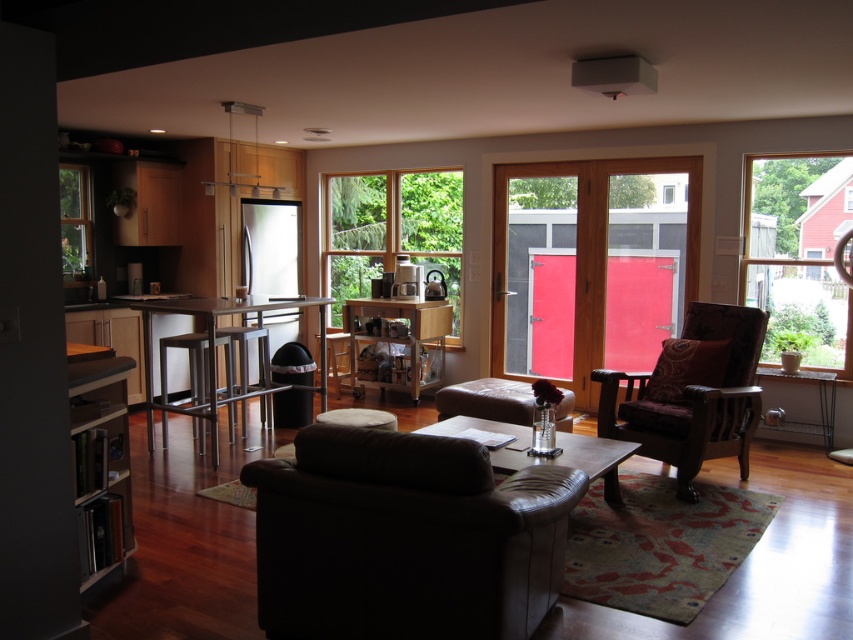
You are planning to place a large potted plant in the living room. The wooden bookshelf at left and the clear glass window at upper left are both potential locations. Based on their sizes, which one do you think would be more suitable for placing the plant?

The clear glass window at upper left occupies more space than the wooden bookshelf at left, so it would be more suitable for placing the large potted plant.

You are standing in the living room and want to place a 12 feet long sofa between the wooden bookshelf at left and the clear glass window at upper left. Can you fit it there?

The distance between the wooden bookshelf at left and the clear glass window at upper left is 11.32 feet. Since the sofa is 12 feet long, it won